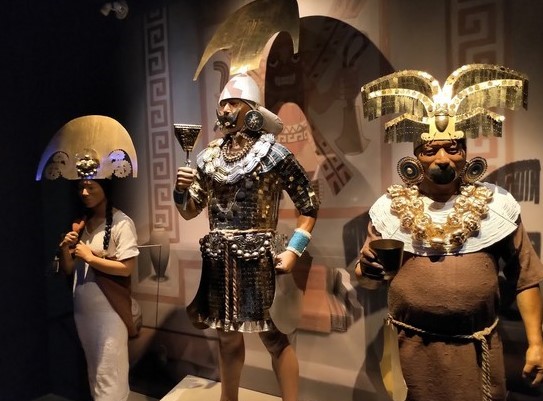
Locate an element on the screen. decorative hats is located at coordinates (97, 138), (250, 37), (441, 104).